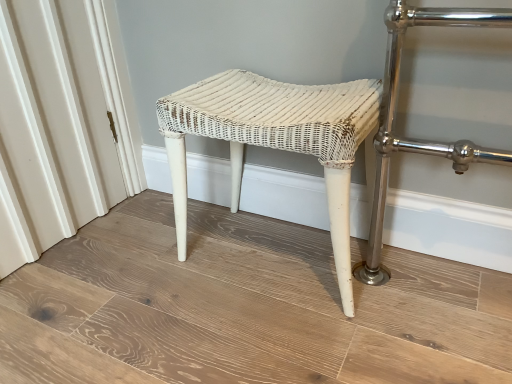
Question: Is point (138, 200) positioned closer to the camera than point (349, 157)?

Choices:
 (A) farther
 (B) closer

Answer: (A)

Question: From a real-world perspective, relative to white wicker stool at center, is white wicker stool at center vertically above or below?

Choices:
 (A) above
 (B) below

Answer: (B)

Question: Considering the positions of white wicker stool at center and white wicker stool at center in the image, is white wicker stool at center taller or shorter than white wicker stool at center?

Choices:
 (A) short
 (B) tall

Answer: (A)

Question: In terms of height, does white wicker stool at center look taller or shorter compared to white wicker stool at center?

Choices:
 (A) short
 (B) tall

Answer: (B)

Question: From the image's perspective, is white wicker stool at center above or below white wicker stool at center?

Choices:
 (A) above
 (B) below

Answer: (A)

Question: Does point (362, 84) appear closer or farther from the camera than point (41, 301)?

Choices:
 (A) closer
 (B) farther

Answer: (A)

Question: Is white wicker stool at center in front of or behind white wicker stool at center in the image?

Choices:
 (A) front
 (B) behind

Answer: (B)